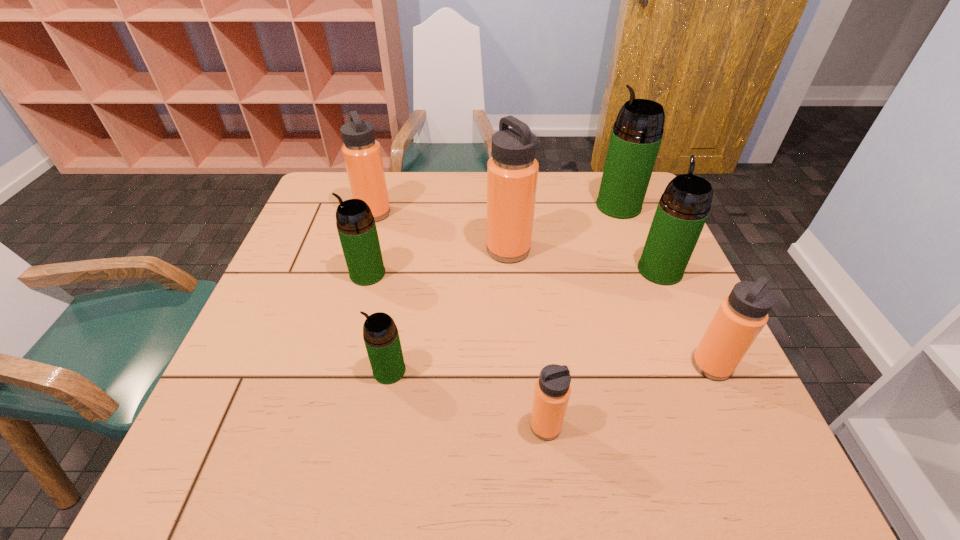
Image resolution: width=960 pixels, height=540 pixels. Find the location of `vacant space located 0.130m from the spout of the leftmost green thermos bottle`. vacant space located 0.130m from the spout of the leftmost green thermos bottle is located at coordinates (299, 274).

Where is `free point located 0.160m on the left of the third farthest orange thermos bottle`? The height and width of the screenshot is (540, 960). free point located 0.160m on the left of the third farthest orange thermos bottle is located at coordinates (615, 366).

Where is `vacant space located from the spout of the sixth object from right to left`? vacant space located from the spout of the sixth object from right to left is located at coordinates 300,370.

At what (x,y) coordinates should I click in order to perform the action: click on vacant region located 0.210m from the spout of the sixth object from right to left. Please return your answer as a coordinate pair (x, y). Image resolution: width=960 pixels, height=540 pixels. Looking at the image, I should click on (271, 370).

Where is `vacant region located from the spout of the sixth object from right to left`? This screenshot has height=540, width=960. vacant region located from the spout of the sixth object from right to left is located at coordinates (329, 370).

At what (x,y) coordinates should I click in order to perform the action: click on vacant space located 0.390m on the back of the nearest object. Please return your answer as a coordinate pair (x, y). This screenshot has height=540, width=960. Looking at the image, I should click on (528, 272).

In order to click on object present at the near edge in this screenshot , I will do `click(552, 391)`.

Identify the location of object present at the left edge. (362, 154).

Locate an element on the screen. object that is at the far left corner is located at coordinates (362, 154).

The image size is (960, 540). What are the coordinates of `object present at the far right corner` in the screenshot? It's located at (636, 136).